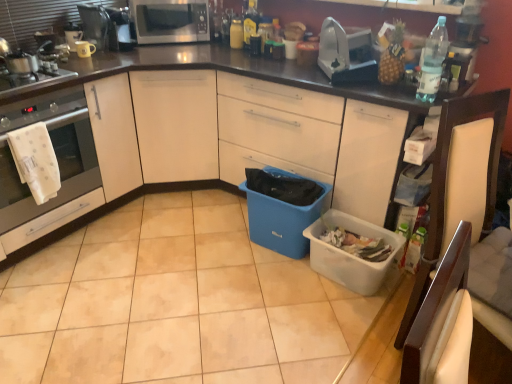
At what (x,y) coordinates should I click in order to perform the action: click on yellow plastic bottle at upper center, which is the 2th bottle in left-to-right order. Please return your answer as a coordinate pair (x, y). Looking at the image, I should click on (250, 22).

This screenshot has height=384, width=512. What do you see at coordinates (31, 79) in the screenshot?
I see `satin silver gas stove at left` at bounding box center [31, 79].

Find the location of a particular element. Image resolution: width=512 pixels, height=384 pixels. satin silver gas stove at left is located at coordinates (31, 79).

What do you see at coordinates (353, 255) in the screenshot?
I see `white plastic storage box at lower right, the 2th storage box from the left` at bounding box center [353, 255].

What do you see at coordinates (446, 186) in the screenshot? I see `white leather chair at right` at bounding box center [446, 186].

Where is `white glossy oven at left`? This screenshot has width=512, height=384. white glossy oven at left is located at coordinates (56, 156).

What is the approximate width of blue plastic bin at center, which appears as the first storage box when viewed from the left?

blue plastic bin at center, which appears as the first storage box when viewed from the left, is 12.88 inches in width.

I want to click on yellow plastic bottle at upper center, positioned as the third bottle in bottom-to-top order, so click(x=250, y=22).

Is yellow plastic bottle at upper center, marked as the second bottle in a back-to-front arrangement, at the left side of satin silver toaster at upper right, which ranks as the 1th appliance in right-to-left order?

Correct, you'll find yellow plastic bottle at upper center, marked as the second bottle in a back-to-front arrangement, to the left of satin silver toaster at upper right, which ranks as the 1th appliance in right-to-left order.

Consider the image. Considering the sizes of objects yellow plastic bottle at upper center, placed as the 2th bottle when sorted from right to left, and satin silver toaster at upper right, which is counted as the 5th appliance, starting from the left, in the image provided, who is thinner, yellow plastic bottle at upper center, placed as the 2th bottle when sorted from right to left, or satin silver toaster at upper right, which is counted as the 5th appliance, starting from the left,?

With smaller width is yellow plastic bottle at upper center, placed as the 2th bottle when sorted from right to left.

Between point (245, 47) and point (348, 27), which one is positioned behind?

The point (245, 47) is more distant.

Is satin silver toaster at upper right, which ranks as the 1th appliance in right-to-left order, completely or partially inside yellow plastic bottle at upper center, which is the 2th bottle in left-to-right order?

No, satin silver toaster at upper right, which ranks as the 1th appliance in right-to-left order, is not a part of yellow plastic bottle at upper center, which is the 2th bottle in left-to-right order.

Does point (18, 87) come closer to viewer compared to point (114, 50)?

Yes, point (18, 87) is closer to viewer.

Does satin silver gas stove at left have a lesser width compared to metallic silver coffee maker at upper left, which is the 2th appliance from right to left?

In fact, satin silver gas stove at left might be wider than metallic silver coffee maker at upper left, which is the 2th appliance from right to left.

Is satin silver gas stove at left bigger than metallic silver coffee maker at upper left, which is counted as the 4th appliance, starting from the left?

Actually, satin silver gas stove at left might be smaller than metallic silver coffee maker at upper left, which is counted as the 4th appliance, starting from the left.

Find the location of a particular element. The height and width of the screenshot is (384, 512). appliance that is the 3rd object above the satin silver gas stove at left (from a real-world perspective) is located at coordinates (119, 29).

Would you say white glossy microwave at upper center is outside blue plastic bin at center, the second storage box positioned from the right?

Yes, white glossy microwave at upper center is outside of blue plastic bin at center, the second storage box positioned from the right.

Considering the sizes of objects white glossy microwave at upper center and blue plastic bin at center, the second storage box positioned from the right, in the image provided, who is bigger, white glossy microwave at upper center or blue plastic bin at center, the second storage box positioned from the right,?

blue plastic bin at center, the second storage box positioned from the right.

The image size is (512, 384). What are the coordinates of `microwave oven above the blue plastic bin at center, which appears as the first storage box when viewed from the left (from the image's perspective)` in the screenshot? It's located at (170, 21).

Could you tell me if white glossy microwave at upper center is facing blue plastic bin at center, which appears as the first storage box when viewed from the left?

No, white glossy microwave at upper center does not turn towards blue plastic bin at center, which appears as the first storage box when viewed from the left.

Can you confirm if white matte cabinet at center is wider than matte white coffee cup at upper left, which is the first appliance in left-to-right order?

Correct, the width of white matte cabinet at center exceeds that of matte white coffee cup at upper left, which is the first appliance in left-to-right order.

Is white matte cabinet at center situated inside matte white coffee cup at upper left, which is the first appliance in left-to-right order, or outside?

white matte cabinet at center is not enclosed by matte white coffee cup at upper left, which is the first appliance in left-to-right order.

Looking at the image, does white matte cabinet at center seem bigger or smaller compared to matte white coffee cup at upper left, which is the fifth appliance from right to left?

In the image, white matte cabinet at center appears to be larger than matte white coffee cup at upper left, which is the fifth appliance from right to left.

From a real-world perspective, between white matte cabinet at center and matte white coffee cup at upper left, which is the first appliance in left-to-right order, who is vertically lower?

From a 3D spatial view, white matte cabinet at center is below.

This screenshot has height=384, width=512. What are the coordinates of `cabinetry beneath the satin silver gas stove at left (from a real-world perspective)` in the screenshot? It's located at (245, 135).

Considering the relative sizes of satin silver gas stove at left and white matte cabinet at center in the image provided, is satin silver gas stove at left thinner than white matte cabinet at center?

Yes.

Between satin silver gas stove at left and white matte cabinet at center, which one appears on the left side from the viewer's perspective?

Positioned to the left is satin silver gas stove at left.

Consider the image. From the image's perspective, is metallic silver coffee maker at upper left, which is the 2th appliance from right to left, located above white matte cabinet at center?

Correct, metallic silver coffee maker at upper left, which is the 2th appliance from right to left, appears higher than white matte cabinet at center in the image.

Considering the points (126, 36) and (212, 135), which point is behind, point (126, 36) or point (212, 135)?

Positioned behind is point (212, 135).

You are a GUI agent. You are given a task and a screenshot of the screen. Output one action in this format:
    pyautogui.click(x=<x>, y=<y>)
    Task: Click on the cabinetry on the right of the metallic silver coffee maker at upper left, which is counted as the 4th appliance, starting from the left
    
    Given the screenshot: What is the action you would take?
    pyautogui.click(x=245, y=135)

Considering the relative sizes of metallic silver coffee maker at upper left, which is counted as the 4th appliance, starting from the left, and white matte cabinet at center in the image provided, is metallic silver coffee maker at upper left, which is counted as the 4th appliance, starting from the left, wider than white matte cabinet at center?

In fact, metallic silver coffee maker at upper left, which is counted as the 4th appliance, starting from the left, might be narrower than white matte cabinet at center.

From the image's perspective, is metallic coffee maker at upper left, the 3th appliance positioned from the left, over white leather chair at right?

Yes, from the image's perspective, metallic coffee maker at upper left, the 3th appliance positioned from the left, is over white leather chair at right.

From a real-world perspective, which is physically above, metallic coffee maker at upper left, the 3th appliance positioned from the left, or white leather chair at right?

From a 3D spatial view, metallic coffee maker at upper left, the 3th appliance positioned from the left, is above.

Is metallic coffee maker at upper left, the 3th appliance positioned from the left, directly adjacent to white leather chair at right?

They are not placed beside each other.

You are a GUI agent. You are given a task and a screenshot of the screen. Output one action in this format:
    pyautogui.click(x=<x>, y=<y>)
    Task: Click on the 1st bottle behind the satin silver toaster at upper right, which is counted as the 5th appliance, starting from the left, starting your count from the anchor
    The height and width of the screenshot is (384, 512).
    Given the screenshot: What is the action you would take?
    pyautogui.click(x=250, y=22)

From a real-world perspective, count 3rd appliances upward from the satin silver gas stove at left and point to it. Please provide its 2D coordinates.

[(119, 29)]

Considering their positions, is white glossy microwave at upper center positioned further to metallic coffee maker at upper left, the 3th appliance positioned from the left, than yellow plastic bottle at upper center, marked as the second bottle in a back-to-front arrangement?

The object further to metallic coffee maker at upper left, the 3th appliance positioned from the left, is yellow plastic bottle at upper center, marked as the second bottle in a back-to-front arrangement.

Based on their spatial positions, is yellow matte mug at upper left, which appears as the second appliance when viewed from the left, or metallic silver coffee maker at upper left, which is the 2th appliance from right to left, further from white glossy microwave at upper center?

Among the two, yellow matte mug at upper left, which appears as the second appliance when viewed from the left, is located further to white glossy microwave at upper center.

Which object lies nearer to the anchor point blue plastic bin at center, which appears as the first storage box when viewed from the left, yellow matte bottle at upper center, the first bottle when ordered from left to right, or white matte cabinet at center?

white matte cabinet at center is positioned closer to the anchor blue plastic bin at center, which appears as the first storage box when viewed from the left.

From the image, which object appears to be farther from white matte cabinet at center, white glossy oven at left or metallic silver coffee maker at upper left, which is the 2th appliance from right to left?

metallic silver coffee maker at upper left, which is the 2th appliance from right to left.

From the image, which object appears to be farther from white plastic storage box at lower right, the 2th storage box from the left, blue plastic bin at center, the second storage box positioned from the right, or satin silver toaster at upper right, which is counted as the 5th appliance, starting from the left?

satin silver toaster at upper right, which is counted as the 5th appliance, starting from the left, lies further to white plastic storage box at lower right, the 2th storage box from the left, than the other object.

From the image, which object appears to be nearer to white plastic storage box at lower right, which is counted as the first storage box, starting from the right, yellow matte mug at upper left, which appears as the second appliance when viewed from the left, or yellow plastic bottle at upper center, marked as the second bottle in a back-to-front arrangement?

yellow plastic bottle at upper center, marked as the second bottle in a back-to-front arrangement, lies closer to white plastic storage box at lower right, which is counted as the first storage box, starting from the right, than the other object.

From the image, which object appears to be nearer to satin silver gas stove at left, metallic silver coffee maker at upper left, which is the 2th appliance from right to left, or white glossy microwave at upper center?

The object closer to satin silver gas stove at left is metallic silver coffee maker at upper left, which is the 2th appliance from right to left.

Looking at the image, which one is located closer to clear plastic bottle at upper right, which is the 3th bottle in top-to-bottom order, white leather chair at right or white glossy oven at left?

white leather chair at right lies closer to clear plastic bottle at upper right, which is the 3th bottle in top-to-bottom order, than the other object.

Locate an element on the screen. The height and width of the screenshot is (384, 512). chair positioned between white matte cabinet at center and metallic silver coffee maker at upper left, which is counted as the 4th appliance, starting from the left, from near to far is located at coordinates (446, 186).

Find the location of a particular element. Image resolution: width=512 pixels, height=384 pixels. home appliance between satin silver gas stove at left and white plastic storage box at lower right, the 2th storage box from the left, in the horizontal direction is located at coordinates (56, 156).

You are a GUI agent. You are given a task and a screenshot of the screen. Output one action in this format:
    pyautogui.click(x=<x>, y=<y>)
    Task: Click on the gas stove between white glossy oven at left and yellow matte mug at upper left, which is counted as the 4th appliance, starting from the right, along the z-axis
    This screenshot has height=384, width=512.
    Given the screenshot: What is the action you would take?
    click(31, 79)

This screenshot has width=512, height=384. In order to click on home appliance between white matte cabinet at center and metallic coffee maker at upper left, the third appliance when ordered from right to left, in the front-back direction in this screenshot , I will do `click(56, 156)`.